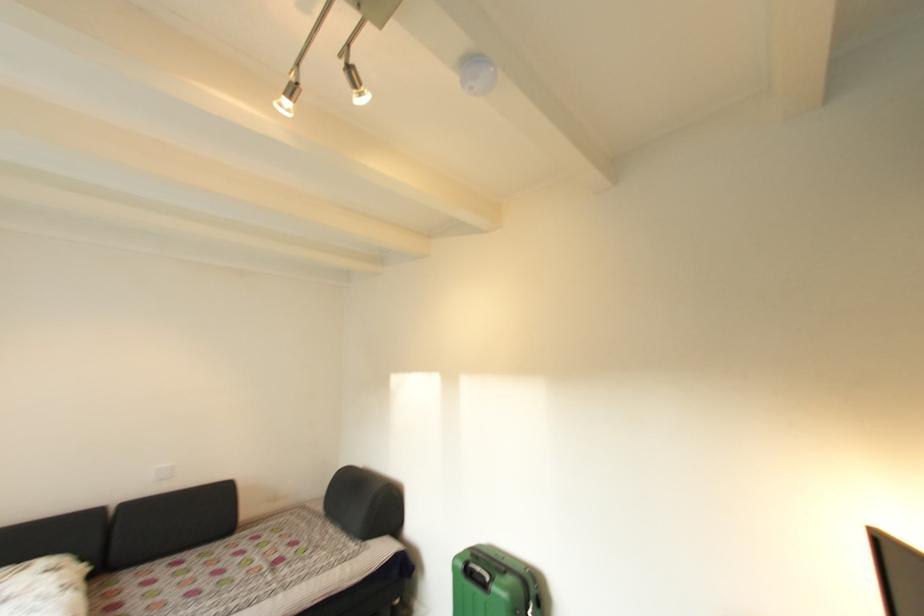
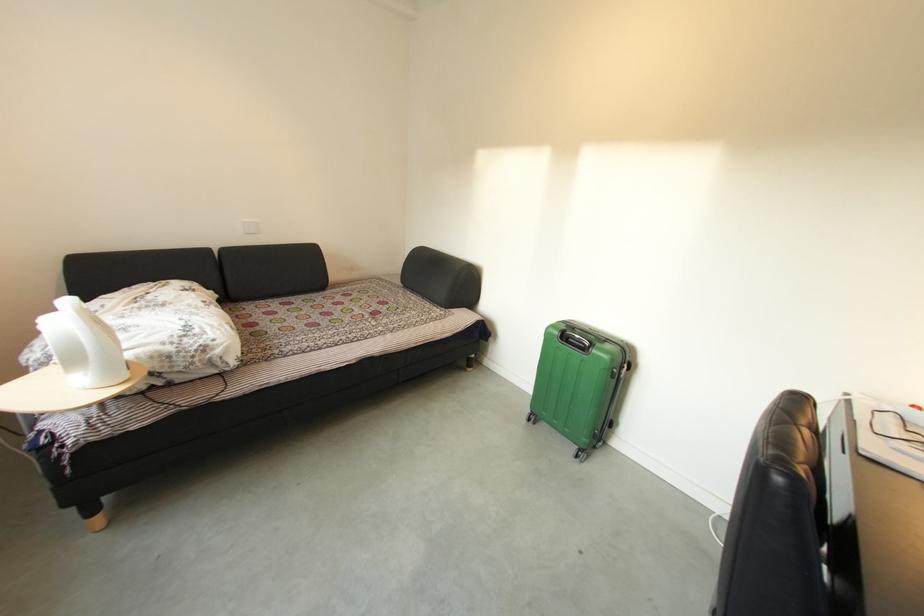
Find the pixel in the second image that matches (471,570) in the first image.

(568, 336)